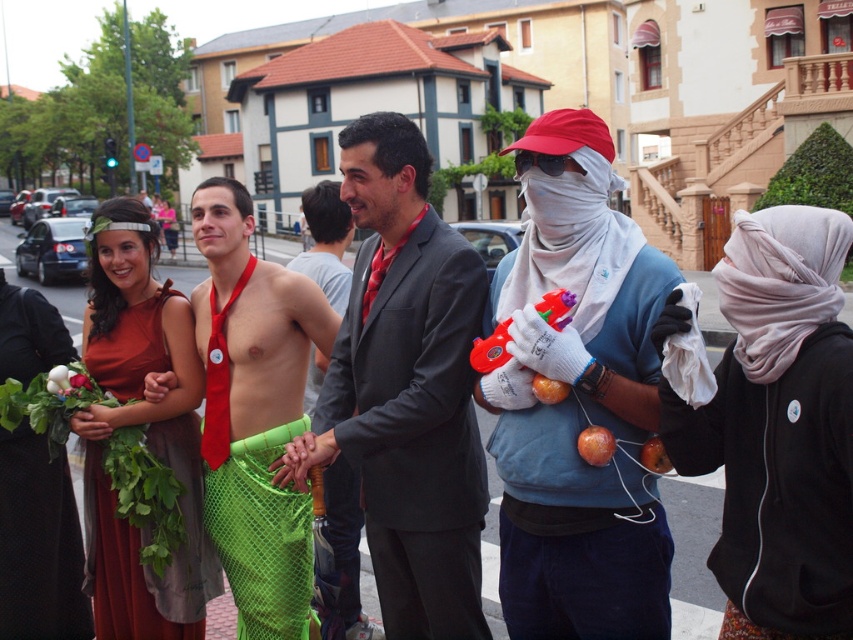
Is point (405, 436) positioned after point (97, 300)?

That is False.

Is point (405, 637) less distant than point (138, 568)?

Yes.

Is point (453, 579) positioned before point (189, 401)?

That is True.

Where is `dark gray suit at center`? The image size is (853, 640). dark gray suit at center is located at coordinates (405, 388).

Between orange matte apple at center and green leafy vegetable at lower left, which one appears on the right side from the viewer's perspective?

Positioned to the right is orange matte apple at center.

Locate an element on the screen. orange matte apple at center is located at coordinates (548, 388).

Image resolution: width=853 pixels, height=640 pixels. Find the location of `orange matte apple at center`. orange matte apple at center is located at coordinates (548, 388).

Between light gray fabric scarf at right and shiny red apple at center, which one is positioned higher?

light gray fabric scarf at right

Is light gray fabric scarf at right closer to camera compared to shiny red apple at center?

Yes, light gray fabric scarf at right is in front of shiny red apple at center.

The width and height of the screenshot is (853, 640). Describe the element at coordinates (778, 428) in the screenshot. I see `light gray fabric scarf at right` at that location.

You are a GUI agent. You are given a task and a screenshot of the screen. Output one action in this format:
    pyautogui.click(x=<x>, y=<y>)
    Task: Click on the light gray fabric scarf at right
    The width and height of the screenshot is (853, 640).
    Given the screenshot: What is the action you would take?
    pyautogui.click(x=778, y=428)